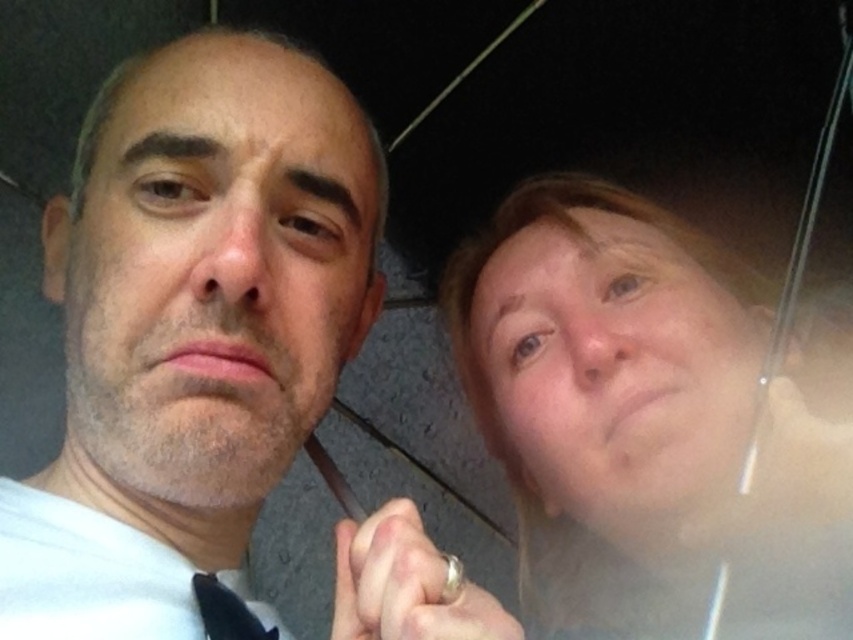
Measure the distance between matte white shirt at left and translucent plastic umbrella at upper right.

matte white shirt at left and translucent plastic umbrella at upper right are 9.18 inches apart from each other.

Consider the image. Who is higher up, matte white shirt at left or translucent plastic umbrella at upper right?

matte white shirt at left is higher up.

Which is in front, point (193, 268) or point (614, 410)?

Positioned in front is point (193, 268).

In order to click on matte white shirt at left in this screenshot , I will do (194, 321).

Based on the photo, does matte white shirt at left appear on the left side of smooth skin face at center?

Incorrect, matte white shirt at left is not on the left side of smooth skin face at center.

Is the position of matte white shirt at left more distant than that of smooth skin face at center?

That is False.

Locate an element on the screen. matte white shirt at left is located at coordinates (194, 321).

Can you confirm if smooth skin face at center is bigger than black silk tie at lower left?

Correct, smooth skin face at center is larger in size than black silk tie at lower left.

Can you confirm if smooth skin face at center is taller than black silk tie at lower left?

Indeed, smooth skin face at center has a greater height compared to black silk tie at lower left.

Describe the element at coordinates (216, 268) in the screenshot. I see `smooth skin face at center` at that location.

The height and width of the screenshot is (640, 853). In order to click on smooth skin face at center in this screenshot , I will do `click(216, 268)`.